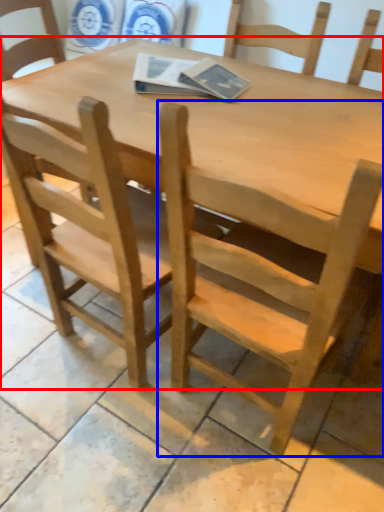
Question: Which point is further to the camera, table (highlighted by a red box) or chair (highlighted by a blue box)?

Choices:
 (A) table
 (B) chair

Answer: (A)